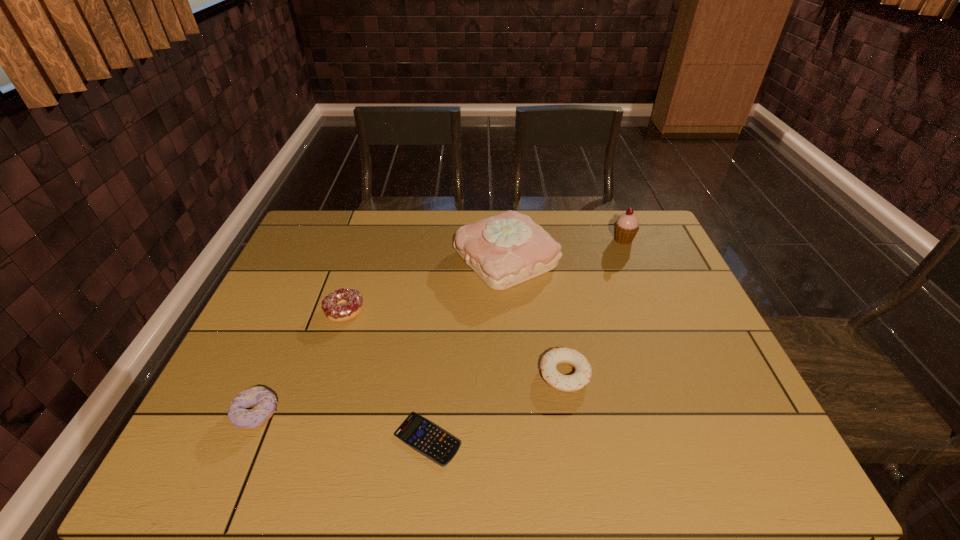
Locate an element on the screen. Image resolution: width=960 pixels, height=540 pixels. free location that satisfies the following two spatial constraints: 1. on the back side of the cake; 2. on the left side of the rightmost object is located at coordinates (505, 240).